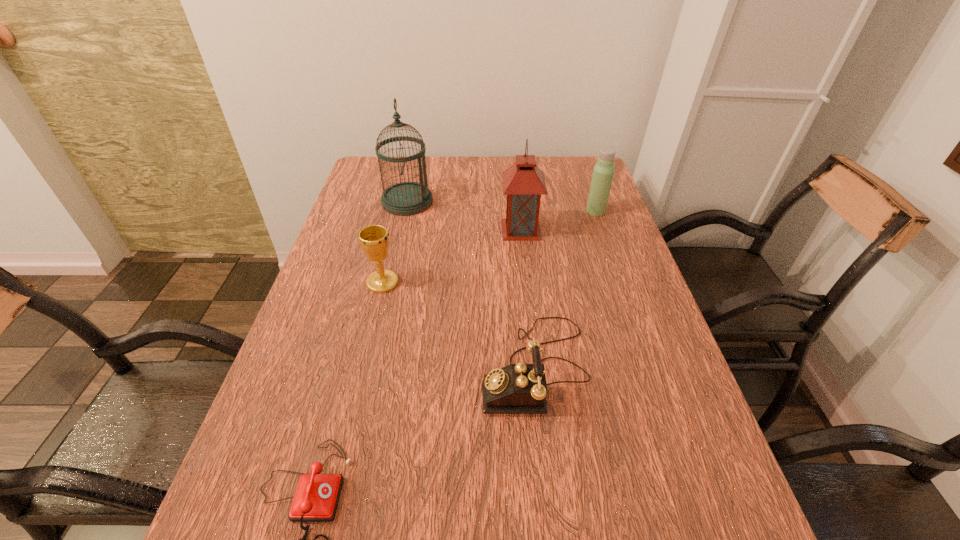
Find the location of a particular element. This screenshot has height=540, width=960. free location located 0.200m on the back of the fifth nearest object is located at coordinates (516, 184).

I want to click on free region located on the back of the rightmost object, so click(578, 160).

The image size is (960, 540). What are the coordinates of `free region located 0.210m on the front of the fourth shortest object` in the screenshot? It's located at (363, 362).

Find the location of a particular element. vacant space located 0.350m on the dial of the taller telephone is located at coordinates (315, 367).

Where is `vacant space located 0.080m on the dial of the taller telephone`? vacant space located 0.080m on the dial of the taller telephone is located at coordinates (444, 367).

The width and height of the screenshot is (960, 540). I want to click on blank area located on the dial of the taller telephone, so click(392, 367).

Locate an element on the screen. This screenshot has height=540, width=960. object at the far edge is located at coordinates (408, 198).

I want to click on birdcage that is at the left edge, so click(408, 198).

What are the coordinates of `chalice that is at the left edge` in the screenshot? It's located at (374, 239).

Identify the location of object situated at the right edge. (603, 172).